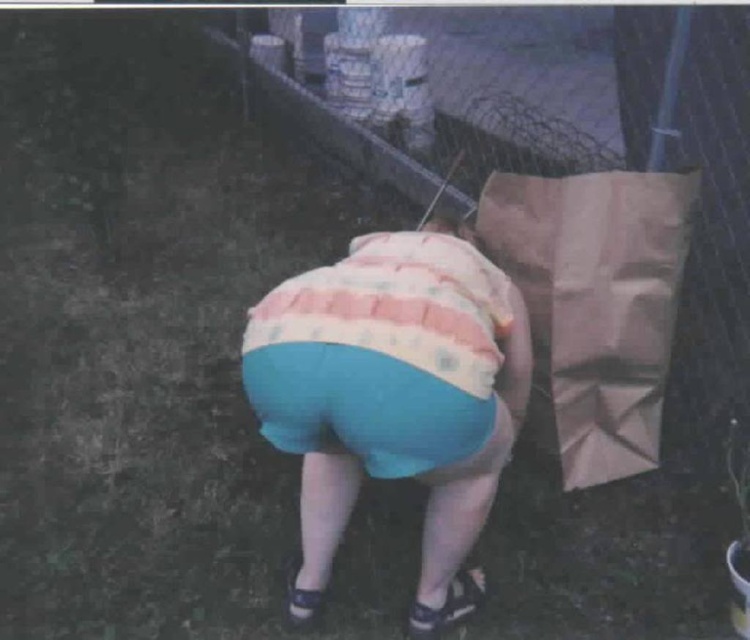
Question: Which point is closer to the camera?

Choices:
 (A) striped cotton shirt at center
 (B) dark blue leather sandal at lower center

Answer: (A)

Question: Which point is closer to the camera taking this photo?

Choices:
 (A) (308, 627)
 (B) (446, 605)

Answer: (B)

Question: Is metallic chain-link fence at upper center below dark blue leather sandal at lower center?

Choices:
 (A) yes
 (B) no

Answer: (B)

Question: Which object appears farthest from the camera in this image?

Choices:
 (A) metallic chain-link fence at upper center
 (B) black fabric sandal at lower center
 (C) dark blue leather sandal at lower center
 (D) striped cotton shirt at center

Answer: (A)

Question: Does brown paper bag at right come behind black fabric sandal at lower center?

Choices:
 (A) yes
 (B) no

Answer: (A)

Question: Can you confirm if metallic chain-link fence at upper center is bigger than striped cotton shirt at center?

Choices:
 (A) no
 (B) yes

Answer: (B)